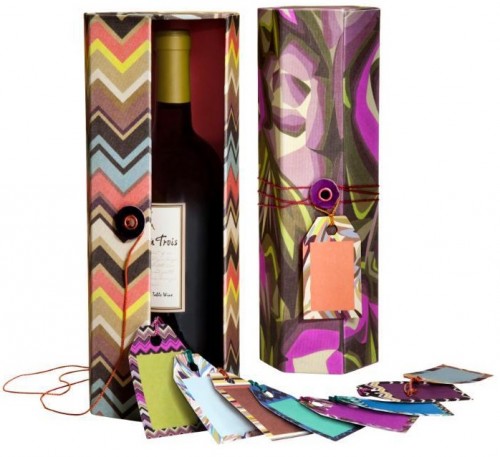
This screenshot has height=457, width=500. What are the coordinates of `dark purple glass wine bottle` in the screenshot? It's located at (200, 164).